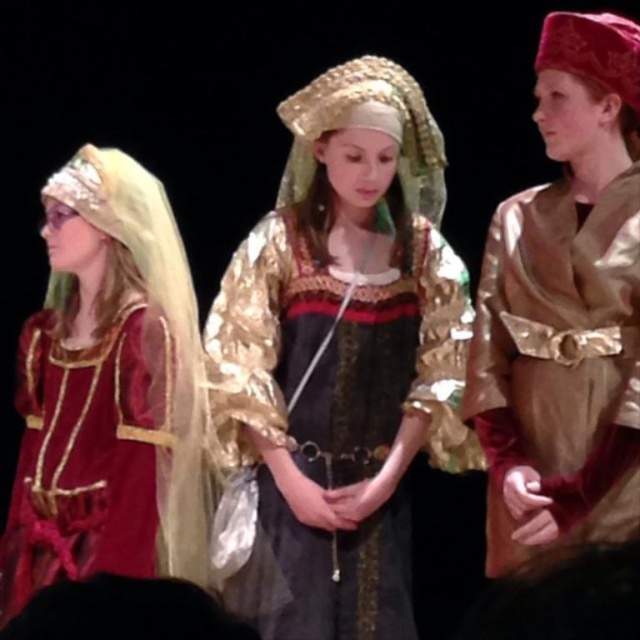
Question: Can you confirm if gold satin robe at right is bigger than matte gold dress at center?

Choices:
 (A) no
 (B) yes

Answer: (A)

Question: Among these objects, which one is nearest to the camera?

Choices:
 (A) gold metallic dress at center
 (B) matte gold dress at center

Answer: (B)

Question: Is gold metallic dress at center to the left of gold satin robe at right from the viewer's perspective?

Choices:
 (A) yes
 (B) no

Answer: (A)

Question: Which point appears farthest from the camera in this image?

Choices:
 (A) (76, 298)
 (B) (340, 461)

Answer: (B)

Question: Which object is positioned closest to the matte gold dress at center?

Choices:
 (A) gold satin robe at right
 (B) gold metallic dress at center

Answer: (B)

Question: Where is gold metallic dress at center located in relation to gold satin robe at right in the image?

Choices:
 (A) left
 (B) right

Answer: (A)